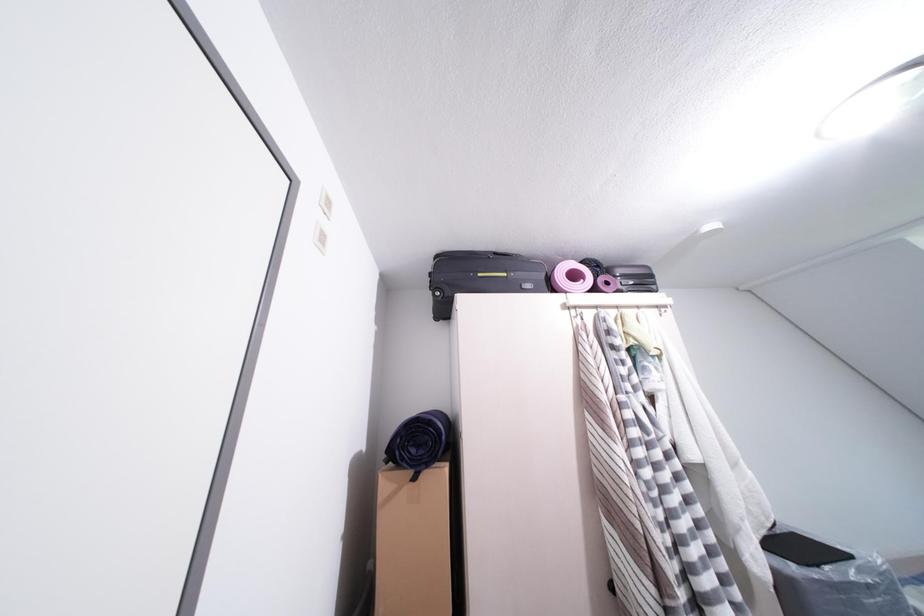
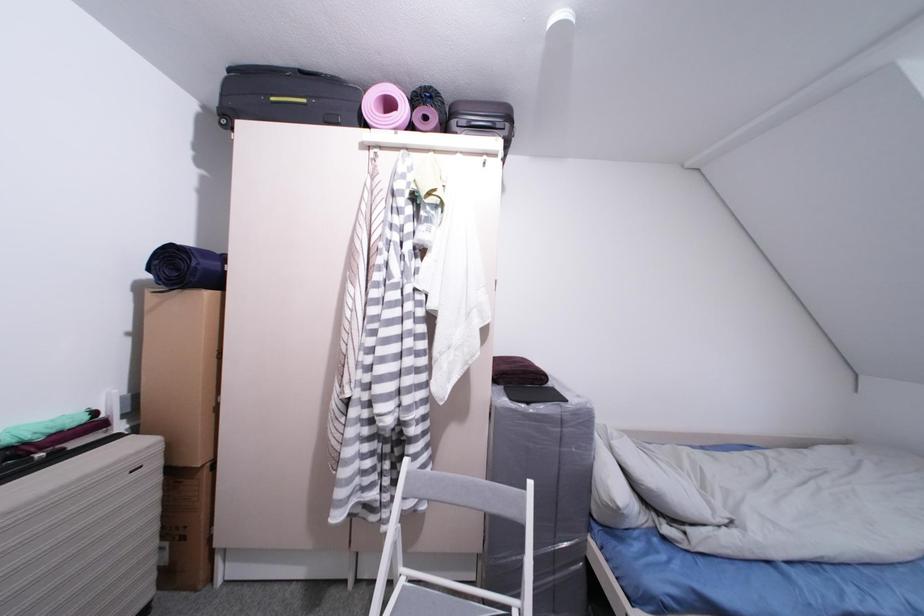
Question: What movement of the cameraman would produce the second image?

Choices:
 (A) Left
 (B) Right
 (C) Forward
 (D) Backward

Answer: (B)